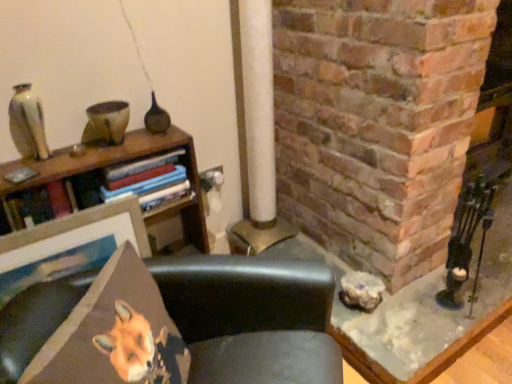
Question: From a real-world perspective, is orange fabric fox at lower left positioned over black leather chair at center based on gravity?

Choices:
 (A) no
 (B) yes

Answer: (B)

Question: From a real-world perspective, is orange fabric fox at lower left below black leather chair at center?

Choices:
 (A) yes
 (B) no

Answer: (B)

Question: Can you confirm if orange fabric fox at lower left is thinner than black leather chair at center?

Choices:
 (A) no
 (B) yes

Answer: (B)

Question: Is orange fabric fox at lower left closer to the viewer compared to black leather chair at center?

Choices:
 (A) yes
 (B) no

Answer: (B)

Question: Is orange fabric fox at lower left to the right of black leather chair at center from the viewer's perspective?

Choices:
 (A) yes
 (B) no

Answer: (B)

Question: Is orange fabric fox at lower left further to camera compared to black leather chair at center?

Choices:
 (A) no
 (B) yes

Answer: (B)

Question: From a real-world perspective, is orange fabric fox at lower left below matte white vase at upper left?

Choices:
 (A) yes
 (B) no

Answer: (A)

Question: Is orange fabric fox at lower left positioned with its back to matte white vase at upper left?

Choices:
 (A) no
 (B) yes

Answer: (A)

Question: Is orange fabric fox at lower left thinner than matte white vase at upper left?

Choices:
 (A) yes
 (B) no

Answer: (B)

Question: Considering the relative sizes of orange fabric fox at lower left and matte white vase at upper left in the image provided, is orange fabric fox at lower left taller than matte white vase at upper left?

Choices:
 (A) yes
 (B) no

Answer: (A)

Question: Can matte white vase at upper left be found inside orange fabric fox at lower left?

Choices:
 (A) no
 (B) yes

Answer: (A)

Question: Can you confirm if orange fabric fox at lower left is shorter than matte white vase at upper left?

Choices:
 (A) no
 (B) yes

Answer: (A)

Question: Does matte white vase at upper left have a larger size compared to black leather chair at center?

Choices:
 (A) yes
 (B) no

Answer: (B)